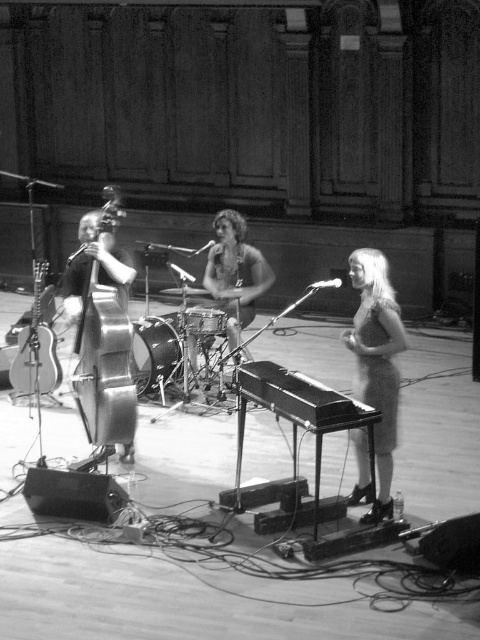
Which is below, shiny brown drum set at center or shiny silver cello at center-left?

shiny brown drum set at center

Does shiny brown drum set at center appear over shiny silver cello at center-left?

Actually, shiny brown drum set at center is below shiny silver cello at center-left.

You are a GUI agent. You are given a task and a screenshot of the screen. Output one action in this format:
    pyautogui.click(x=<x>, y=<y>)
    Task: Click on the shiny brown drum set at center
    The height and width of the screenshot is (640, 480).
    Given the screenshot: What is the action you would take?
    pyautogui.click(x=235, y=273)

Is satin dress at center to the left of shiny silver cello at center-left from the viewer's perspective?

No, satin dress at center is not to the left of shiny silver cello at center-left.

Between satin dress at center and shiny silver cello at center-left, which one has less height?

shiny silver cello at center-left

Between point (363, 401) and point (109, 284), which one is positioned behind?

The point (109, 284) is more distant.

Where is `satin dress at center`? Image resolution: width=480 pixels, height=640 pixels. satin dress at center is located at coordinates (376, 362).

Does shiny brown drum set at center have a lesser height compared to acoustic wood guitar at left?

No.

The width and height of the screenshot is (480, 640). I want to click on shiny brown drum set at center, so coord(235,273).

Where is `shiny brown drum set at center`? Image resolution: width=480 pixels, height=640 pixels. shiny brown drum set at center is located at coordinates (235, 273).